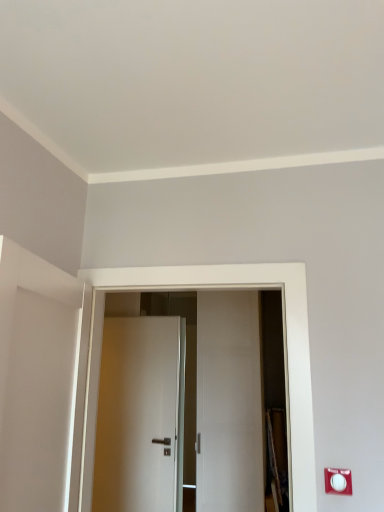
Question: Is white plastic electric outlet at lower right shorter than white matte door at center, which is the first door in back-to-front order?

Choices:
 (A) no
 (B) yes

Answer: (B)

Question: Is white plastic electric outlet at lower right not within white matte door at center, which is the first door in back-to-front order?

Choices:
 (A) yes
 (B) no

Answer: (A)

Question: From the image's perspective, does white plastic electric outlet at lower right appear lower than white matte door at center, the second door viewed from the front?

Choices:
 (A) no
 (B) yes

Answer: (A)

Question: Would you say white plastic electric outlet at lower right contains white matte door at center, which is the first door in back-to-front order?

Choices:
 (A) no
 (B) yes

Answer: (A)

Question: Is white plastic electric outlet at lower right to the left of white matte door at center, the second door viewed from the front, from the viewer's perspective?

Choices:
 (A) yes
 (B) no

Answer: (B)

Question: Is white matte door at center, the second door viewed from the front, in front of or behind white glossy door at center, which is counted as the 2th door, starting from the back, in the image?

Choices:
 (A) behind
 (B) front

Answer: (A)

Question: In terms of size, does white matte door at center, the second door viewed from the front, appear bigger or smaller than white glossy door at center, which appears as the 1th door when viewed from the front?

Choices:
 (A) big
 (B) small

Answer: (B)

Question: From the image's perspective, relative to white glossy door at center, which is counted as the 2th door, starting from the back, is white matte door at center, the second door viewed from the front, above or below?

Choices:
 (A) above
 (B) below

Answer: (B)

Question: Which is correct: white matte door at center, the second door viewed from the front, is inside white glossy door at center, which is counted as the 2th door, starting from the back, or outside of it?

Choices:
 (A) outside
 (B) inside

Answer: (A)

Question: Visually, is white plastic electric outlet at lower right positioned to the left or to the right of white glossy door at center, which is counted as the 2th door, starting from the back?

Choices:
 (A) left
 (B) right

Answer: (B)

Question: In the image, is white plastic electric outlet at lower right positioned in front of or behind white glossy door at center, which appears as the 1th door when viewed from the front?

Choices:
 (A) front
 (B) behind

Answer: (B)

Question: Looking at their shapes, would you say white plastic electric outlet at lower right is wider or thinner than white glossy door at center, which appears as the 1th door when viewed from the front?

Choices:
 (A) wide
 (B) thin

Answer: (B)

Question: From the image's perspective, relative to white glossy door at center, which is counted as the 2th door, starting from the back, is white plastic electric outlet at lower right above or below?

Choices:
 (A) above
 (B) below

Answer: (B)

Question: Is point (339, 473) positioned closer to the camera than point (183, 419)?

Choices:
 (A) farther
 (B) closer

Answer: (B)

Question: From the image's perspective, is white plastic electric outlet at lower right positioned above or below white matte door at center, which is the first door in back-to-front order?

Choices:
 (A) above
 (B) below

Answer: (A)